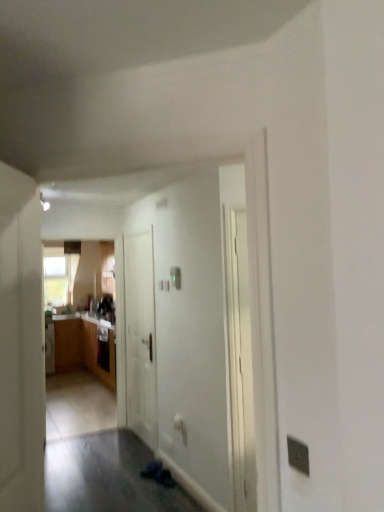
Question: Is white matte door at center, acting as the 2th door starting from the front, spatially inside wooden cabinet at left, or outside of it?

Choices:
 (A) inside
 (B) outside

Answer: (B)

Question: Based on their sizes in the image, would you say white matte door at center, which appears as the 1th door when viewed from the back, is bigger or smaller than wooden cabinet at left?

Choices:
 (A) big
 (B) small

Answer: (B)

Question: Which is nearer to the white matte door at left, which is the 2th door in back-to-front order?

Choices:
 (A) wooden cabinet at left
 (B) white matte door at center, which appears as the 1th door when viewed from the back

Answer: (B)

Question: Considering the real-world distances, which object is farthest from the wooden cabinet at left?

Choices:
 (A) white matte door at center, which appears as the 1th door when viewed from the back
 (B) white matte door at left, which is the 2th door in back-to-front order

Answer: (B)